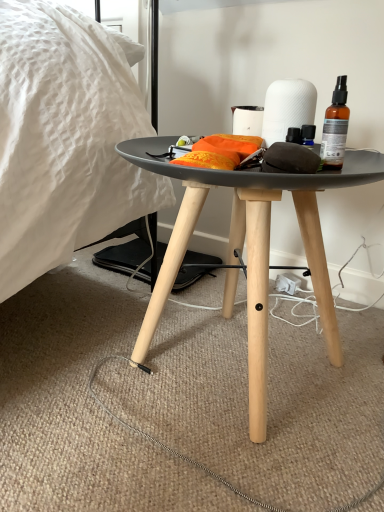
Question: Is white matte paper towel at center positioned with its back to orange fabric at center?

Choices:
 (A) yes
 (B) no

Answer: (B)

Question: Is white matte paper towel at center far away from orange fabric at center?

Choices:
 (A) yes
 (B) no

Answer: (B)

Question: Is white matte paper towel at center smaller than orange fabric at center?

Choices:
 (A) yes
 (B) no

Answer: (A)

Question: Does white matte paper towel at center have a lesser height compared to orange fabric at center?

Choices:
 (A) yes
 (B) no

Answer: (B)

Question: Is white matte paper towel at center completely or partially outside of orange fabric at center?

Choices:
 (A) yes
 (B) no

Answer: (A)

Question: In terms of size, does black matte side table at center appear bigger or smaller than white matte paper towel at center?

Choices:
 (A) small
 (B) big

Answer: (B)

Question: In the image, is black matte side table at center positioned in front of or behind white matte paper towel at center?

Choices:
 (A) front
 (B) behind

Answer: (A)

Question: Is black matte side table at center taller or shorter than white matte paper towel at center?

Choices:
 (A) short
 (B) tall

Answer: (B)

Question: Is black matte side table at center inside the boundaries of white matte paper towel at center, or outside?

Choices:
 (A) outside
 (B) inside

Answer: (A)

Question: From their relative heights in the image, would you say orange fabric at center is taller or shorter than black matte side table at center?

Choices:
 (A) short
 (B) tall

Answer: (A)

Question: Considering the positions of orange fabric at center and black matte side table at center in the image, is orange fabric at center bigger or smaller than black matte side table at center?

Choices:
 (A) big
 (B) small

Answer: (B)

Question: From a real-world perspective, is orange fabric at center positioned above or below black matte side table at center?

Choices:
 (A) below
 (B) above

Answer: (B)

Question: Would you say orange fabric at center is inside or outside black matte side table at center?

Choices:
 (A) outside
 (B) inside

Answer: (B)

Question: Is point [x=193, y=143] closer or farther from the camera than point [x=347, y=112]?

Choices:
 (A) farther
 (B) closer

Answer: (A)

Question: Considering the positions of orange fabric at center and translucent amber glass spray bottle at upper right in the image, is orange fabric at center bigger or smaller than translucent amber glass spray bottle at upper right?

Choices:
 (A) big
 (B) small

Answer: (A)